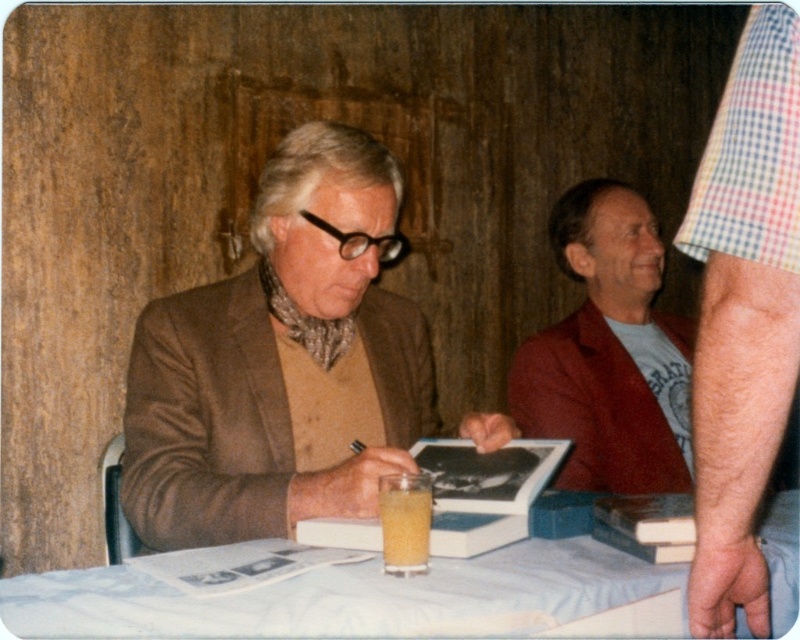
Is checkered fabric arm at right positioned behind white cloth at lower center?

No, checkered fabric arm at right is closer to the viewer.

Locate an element on the screen. checkered fabric arm at right is located at coordinates (744, 316).

Where is `checkered fabric arm at right`? This screenshot has width=800, height=640. checkered fabric arm at right is located at coordinates (744, 316).

Between checkered fabric arm at right and translucent yellow liquid at table center, which one appears on the left side from the viewer's perspective?

Positioned to the left is translucent yellow liquid at table center.

Between point (794, 371) and point (408, 508), which one is positioned in front?

Point (794, 371) is in front.

Image resolution: width=800 pixels, height=640 pixels. What are the coordinates of `checkered fabric arm at right` in the screenshot? It's located at (744, 316).

Who is more distant from viewer, (772, 385) or (644, 305)?

Point (644, 305)

Can you confirm if checkered fabric arm at right is smaller than red velvet blazer at right?

Yes.

Image resolution: width=800 pixels, height=640 pixels. Describe the element at coordinates (744, 316) in the screenshot. I see `checkered fabric arm at right` at that location.

The height and width of the screenshot is (640, 800). I want to click on checkered fabric arm at right, so click(744, 316).